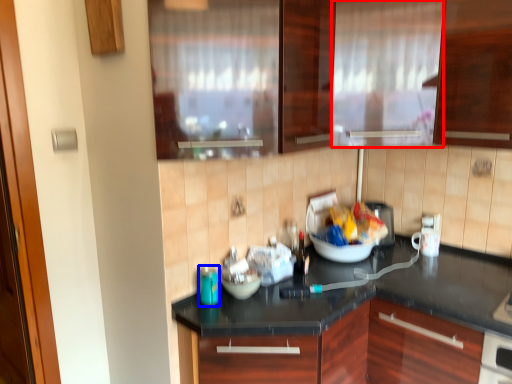
Question: Among these objects, which one is nearest to the camera, curtain (highlighted by a red box) or appliance (highlighted by a blue box)?

Choices:
 (A) curtain
 (B) appliance

Answer: (B)